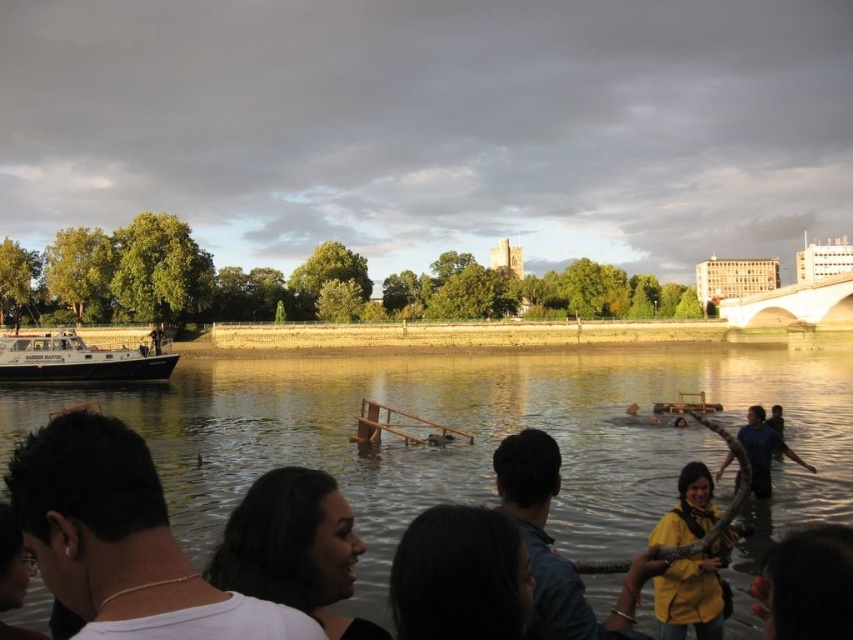
Who is more forward, (320, 538) or (32, 380)?

Point (320, 538) is in front.

Does dark brown hair at center appear under white matte boat at left?

Correct, dark brown hair at center is located below white matte boat at left.

Is point (309, 474) behind point (122, 369)?

No, (309, 474) is closer to viewer.

Where is `dark brown hair at center`? The height and width of the screenshot is (640, 853). dark brown hair at center is located at coordinates pyautogui.click(x=293, y=548).

Who is more distant from viewer, (70, 481) or (825, 566)?

The point (825, 566) is more distant.

Is point (50, 518) closer to viewer compared to point (767, 614)?

Yes, it is.

Locate an element on the screen. white matte shirt at lower left is located at coordinates tap(122, 540).

Is smooth water at center above dark blue shirt at lower right?

Yes.

Which is in front, point (3, 433) or point (780, 420)?

Positioned in front is point (780, 420).

Between point (379, 468) and point (769, 413), which one is positioned in front?

Point (379, 468) is more forward.

The image size is (853, 640). I want to click on smooth water at center, so click(x=477, y=436).